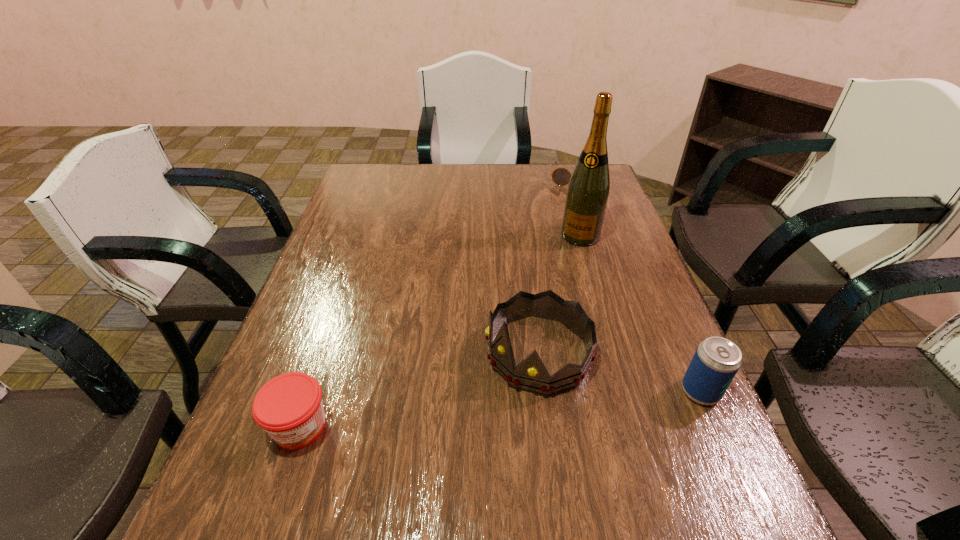
This screenshot has height=540, width=960. I want to click on jam, so click(289, 407).

Identify the location of the second shortest object. (289, 407).

Identify the location of beer can. The width and height of the screenshot is (960, 540). (716, 361).

Where is `the tallest object`? The width and height of the screenshot is (960, 540). the tallest object is located at coordinates (587, 194).

Identify the location of the fourth nearest object. The width and height of the screenshot is (960, 540). (587, 194).

At what (x,y) coordinates should I click in order to perform the action: click on the farthest object. Please return your answer as a coordinate pair (x, y). The width and height of the screenshot is (960, 540). Looking at the image, I should click on (561, 176).

You are a GUI agent. You are given a task and a screenshot of the screen. Output one action in this format:
    pyautogui.click(x=<x>, y=<y>)
    Task: Click on the shortest object
    
    Given the screenshot: What is the action you would take?
    pyautogui.click(x=561, y=176)

The width and height of the screenshot is (960, 540). I want to click on tiara, so click(531, 374).

What are the coordinates of `vacant region located 0.080m on the back of the beer can` in the screenshot? It's located at (681, 347).

I want to click on vacant space located 0.270m on the front-facing side of the wine bottle, so point(548,306).